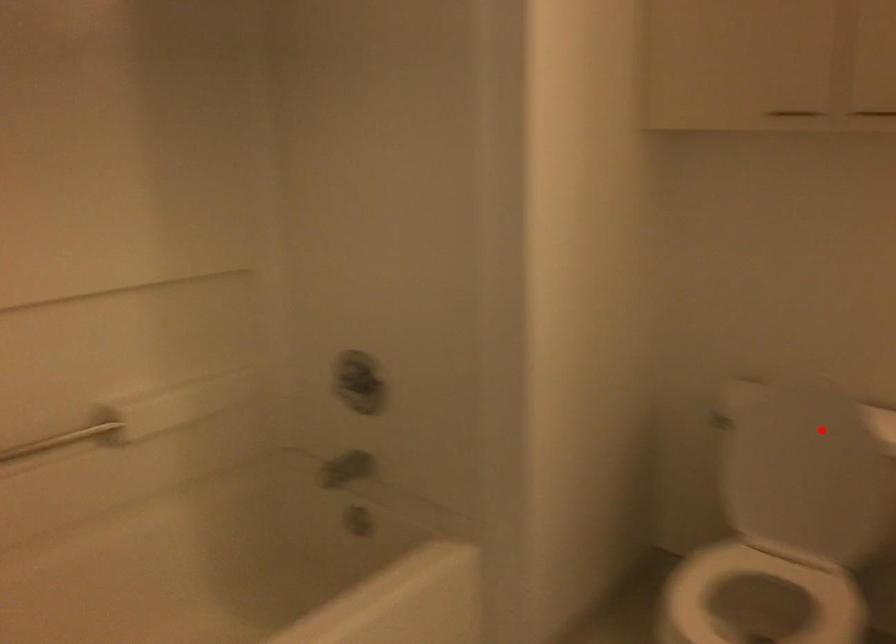
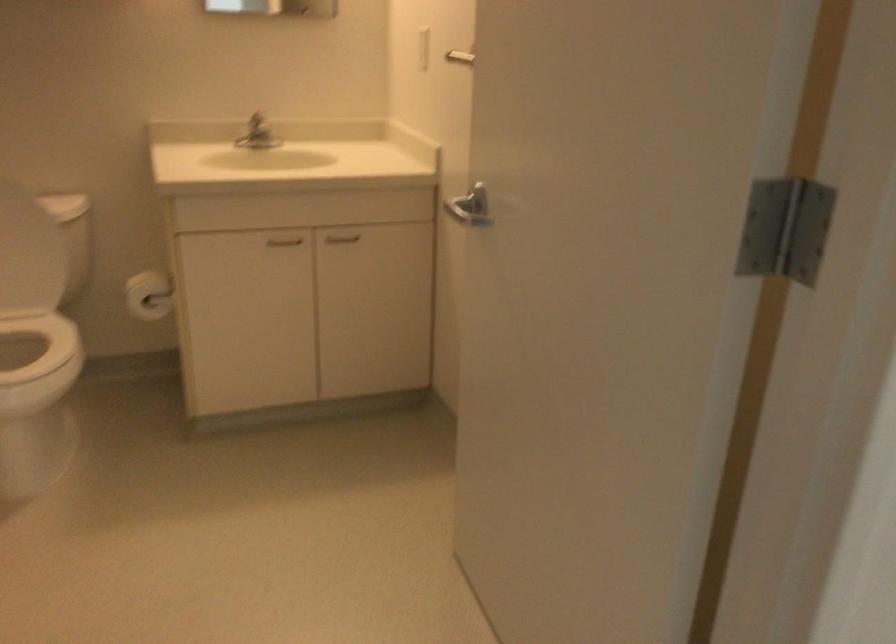
Locate, in the second image, the point that corresponds to the highlighted location in the first image.

(12, 210)